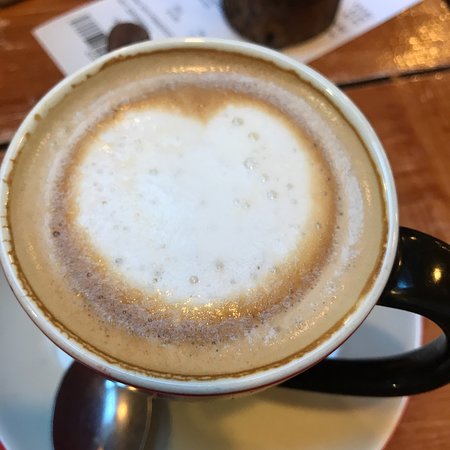
Where is `black handle on coffee cop`? The width and height of the screenshot is (450, 450). black handle on coffee cop is located at coordinates (417, 296), (377, 380).